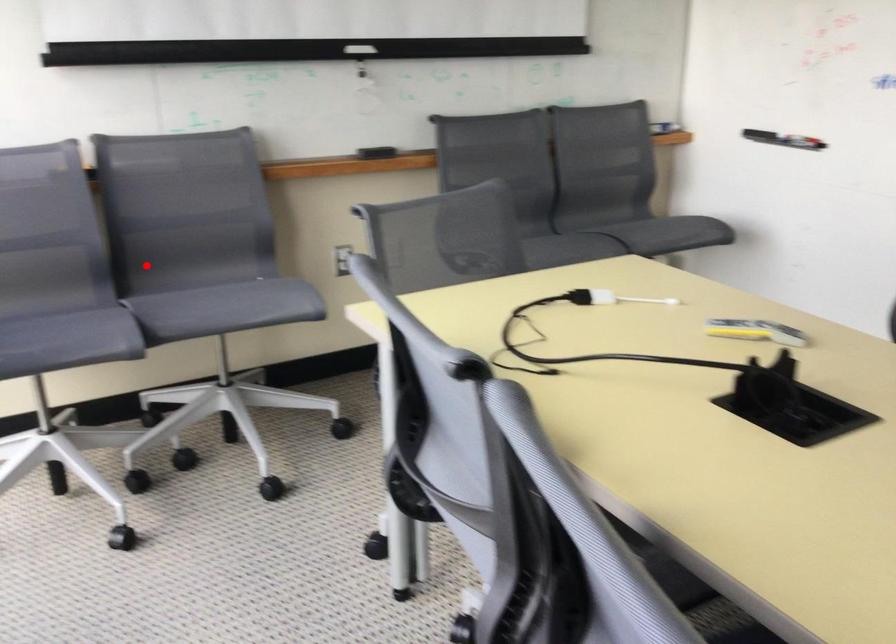
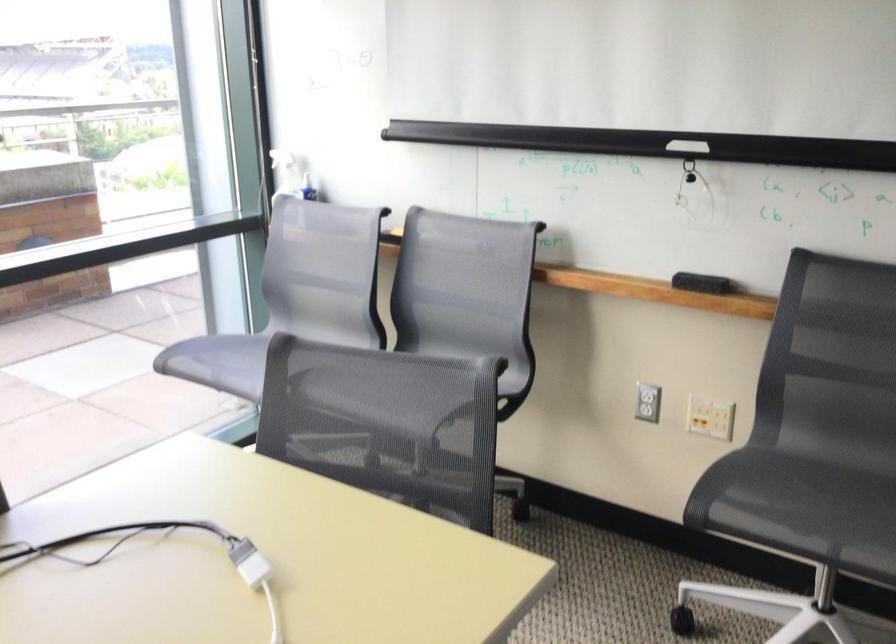
In the second image, find the point that corresponds to the highlighted location in the first image.

(426, 337)